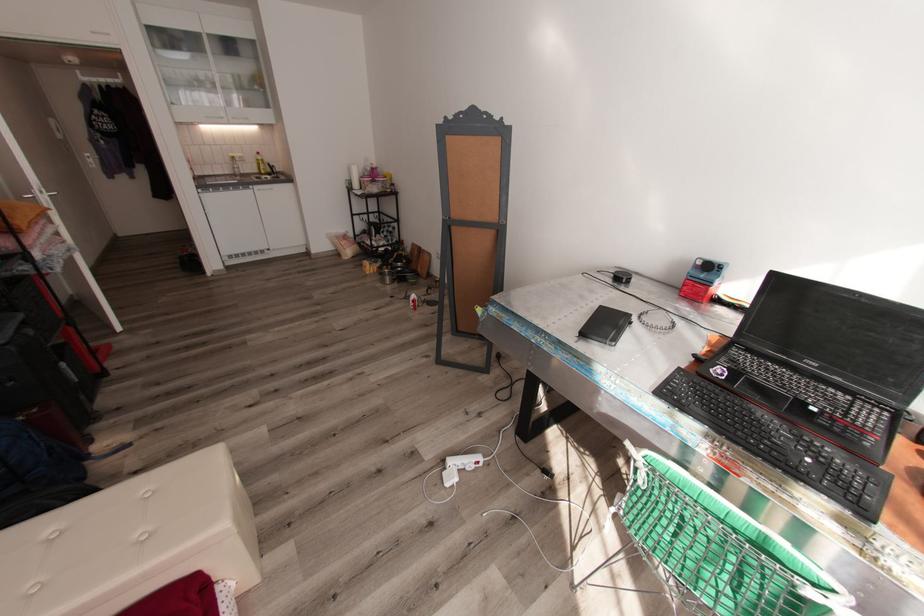
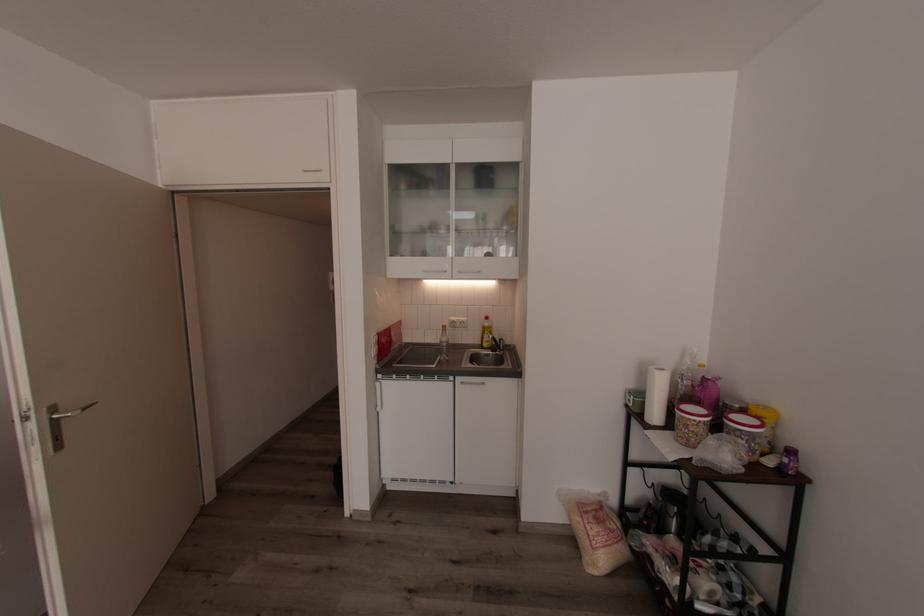
Find the pixel in the second image that matches pixel 252 118 in the first image.

(484, 272)